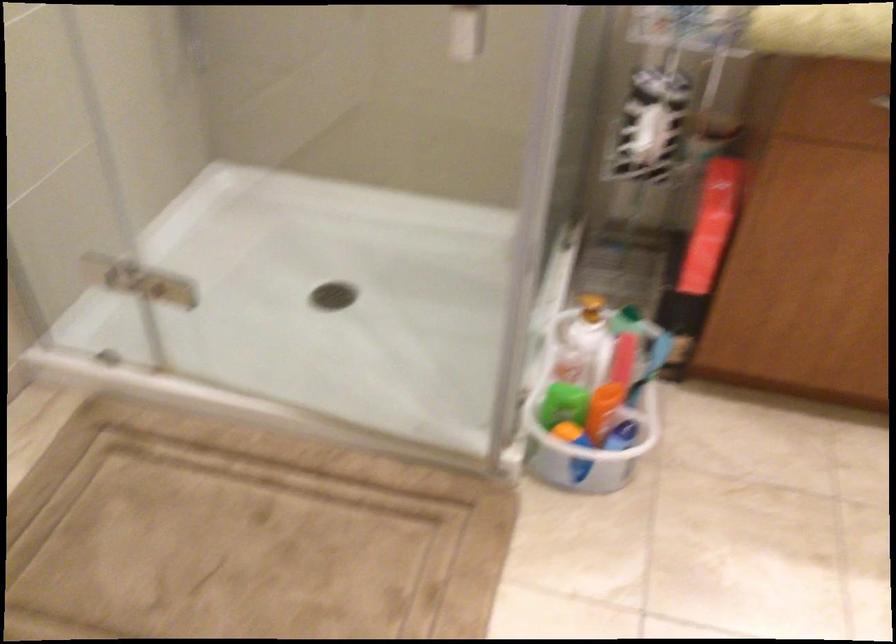
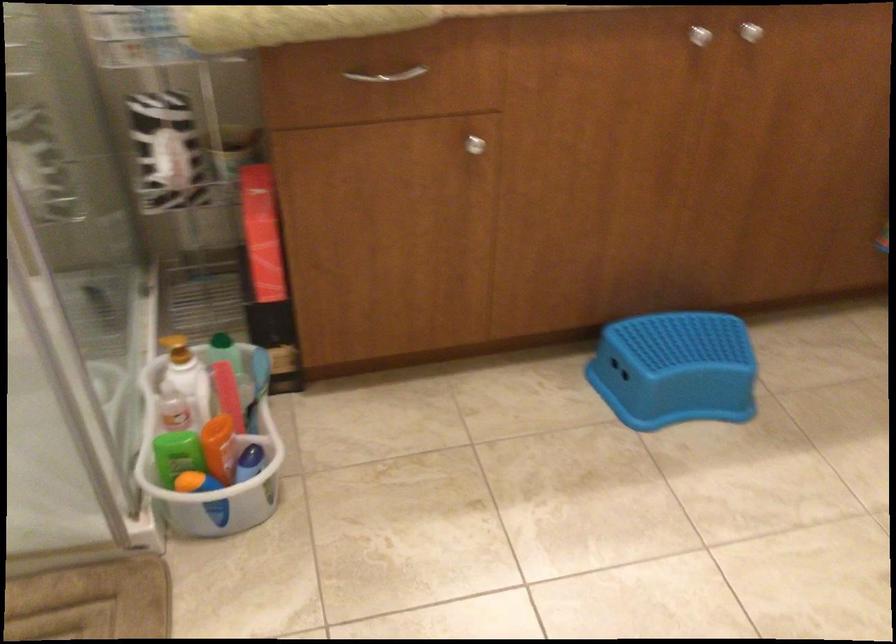
The point at (604, 406) is marked in the first image. Where is the corresponding point in the second image?

(220, 448)